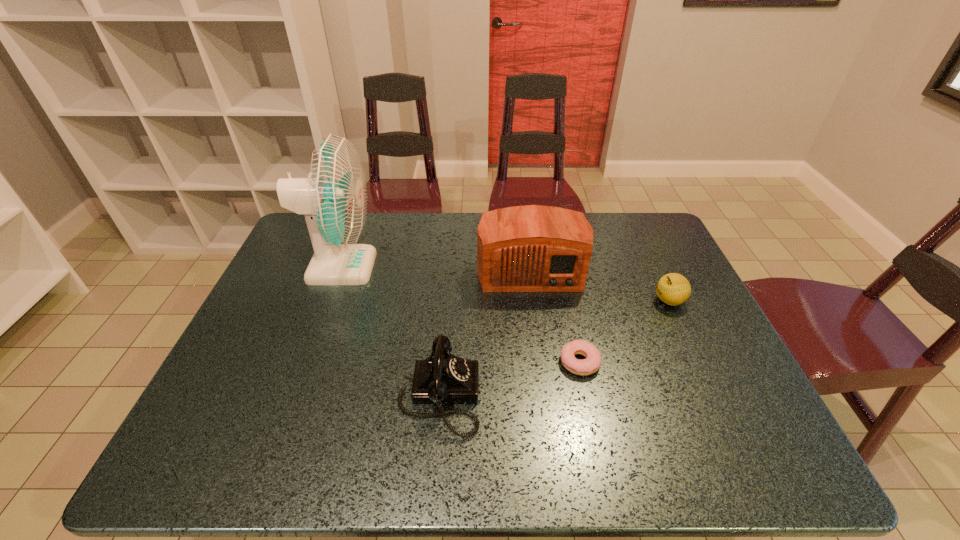
Find the location of a particular element. This screenshot has width=960, height=540. vacant point at the far edge is located at coordinates (429, 227).

The height and width of the screenshot is (540, 960). I want to click on free point at the near edge, so click(472, 471).

Find the location of a particular element. The image size is (960, 540). vacant point at the left edge is located at coordinates (262, 300).

In the image, there is a desktop. Identify the location of vacant space at the right edge. The height and width of the screenshot is (540, 960). [x=699, y=314].

Identify the location of free location at the far right corner of the desktop. (636, 227).

Where is `free area in between the second tallest object and the shortest object`? This screenshot has height=540, width=960. free area in between the second tallest object and the shortest object is located at coordinates (555, 315).

Find the location of `vacant space that is in between the radio receiver and the tallest object`. vacant space that is in between the radio receiver and the tallest object is located at coordinates (435, 267).

What are the coordinates of `vacant space that is in between the fan and the shortest object` in the screenshot? It's located at (460, 314).

The width and height of the screenshot is (960, 540). Find the location of `vacant area that lies between the second tallest object and the third tallest object`. vacant area that lies between the second tallest object and the third tallest object is located at coordinates (485, 332).

Find the location of `free point between the fan and the telephone`. free point between the fan and the telephone is located at coordinates (390, 331).